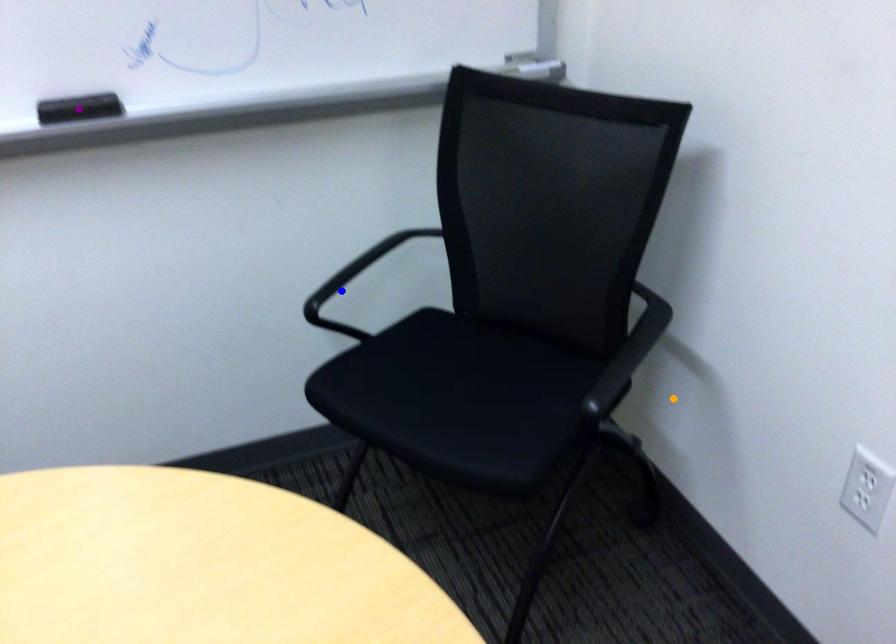
Order these from farthest to nearest:
- orange point
- purple point
- blue point

1. orange point
2. blue point
3. purple point